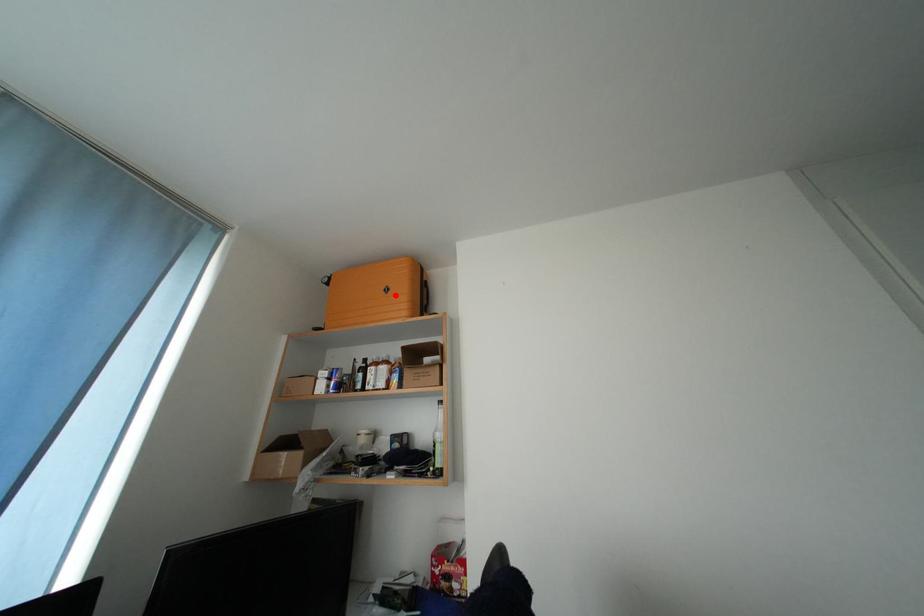
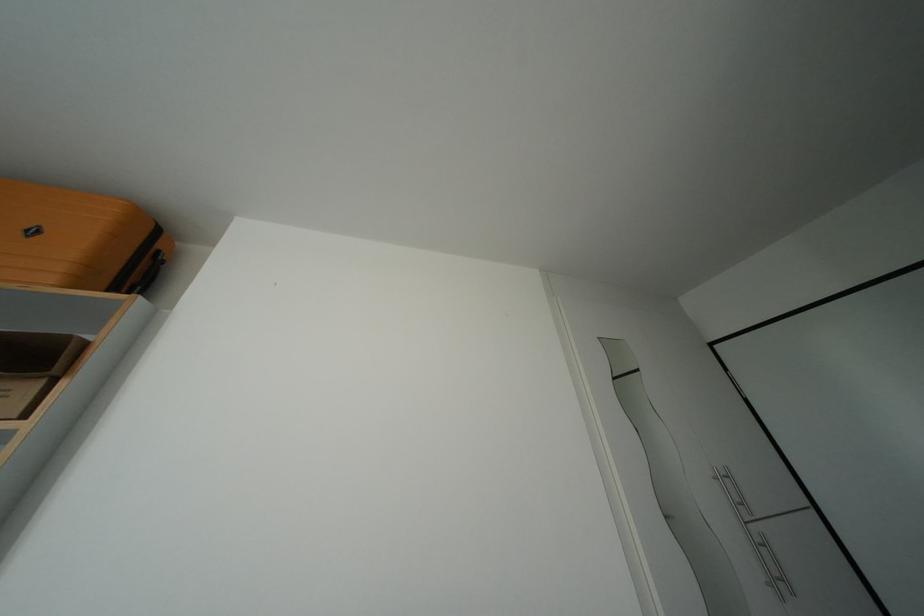
Where in the second image is the point corresponding to the highlighted location from the first image?

(42, 237)